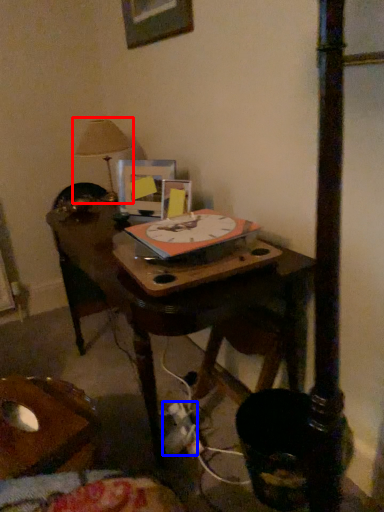
Question: Which point is closer to the camera, table lamp (highlighted by a red box) or plug (highlighted by a blue box)?

Choices:
 (A) table lamp
 (B) plug

Answer: (B)